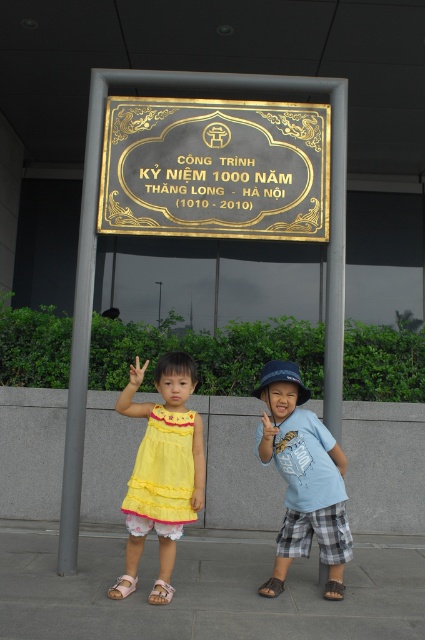
Measure the distance between gold/black plaque at center and yellow cotton dress at center.

gold/black plaque at center is 4.60 feet away from yellow cotton dress at center.

Between gold/black plaque at center and yellow cotton dress at center, which one appears on the right side from the viewer's perspective?

From the viewer's perspective, gold/black plaque at center appears more on the right side.

Which is behind, point (252, 147) or point (169, 548)?

The point (252, 147) is more distant.

The height and width of the screenshot is (640, 425). Find the location of `gold/black plaque at center`. gold/black plaque at center is located at coordinates (215, 168).

Describe the element at coordinates (303, 477) in the screenshot. I see `yellow cotton dress at lower center` at that location.

Does yellow cotton dress at lower center appear over yellow cotton dress at center?

Actually, yellow cotton dress at lower center is below yellow cotton dress at center.

Which is in front, point (167, 419) or point (136, 563)?

Point (167, 419) is more forward.

You are a GUI agent. You are given a task and a screenshot of the screen. Output one action in this format:
    pyautogui.click(x=<x>, y=<y>)
    Task: Click on the yellow cotton dress at lower center
    Image resolution: width=425 pixels, height=640 pixels.
    Given the screenshot: What is the action you would take?
    pyautogui.click(x=303, y=477)

Is yellow cotton dress at lower center below blue cotton shirt at center?

Indeed, yellow cotton dress at lower center is positioned under blue cotton shirt at center.

Find the location of a particular element. yellow cotton dress at lower center is located at coordinates (303, 477).

Locate an element on the screen. This screenshot has height=640, width=425. yellow cotton dress at lower center is located at coordinates (303, 477).